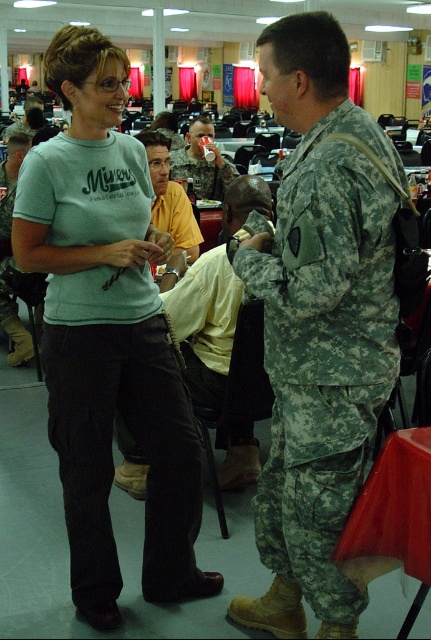
Question: Which point is closer to the camera taking this photo?

Choices:
 (A) [x=246, y=214]
 (B) [x=368, y=419]

Answer: (B)

Question: Which of the following is the farthest from the observer?

Choices:
 (A) camouflage fabric uniform at center
 (B) camouflage uniform at center
 (C) light blue t-shirt at center
 (D) camouflage fabric uniform at right

Answer: (A)

Question: Which object appears farthest from the camera in this image?

Choices:
 (A) camouflage uniform at center
 (B) camouflage fabric uniform at center
 (C) light blue t-shirt at center

Answer: (B)

Question: Is camouflage uniform at center wider than camouflage fabric uniform at center?

Choices:
 (A) no
 (B) yes

Answer: (A)

Question: Does light blue t-shirt at center come in front of camouflage uniform at center?

Choices:
 (A) no
 (B) yes

Answer: (B)

Question: Does light blue t-shirt at center appear on the right side of camouflage uniform at center?

Choices:
 (A) no
 (B) yes

Answer: (A)